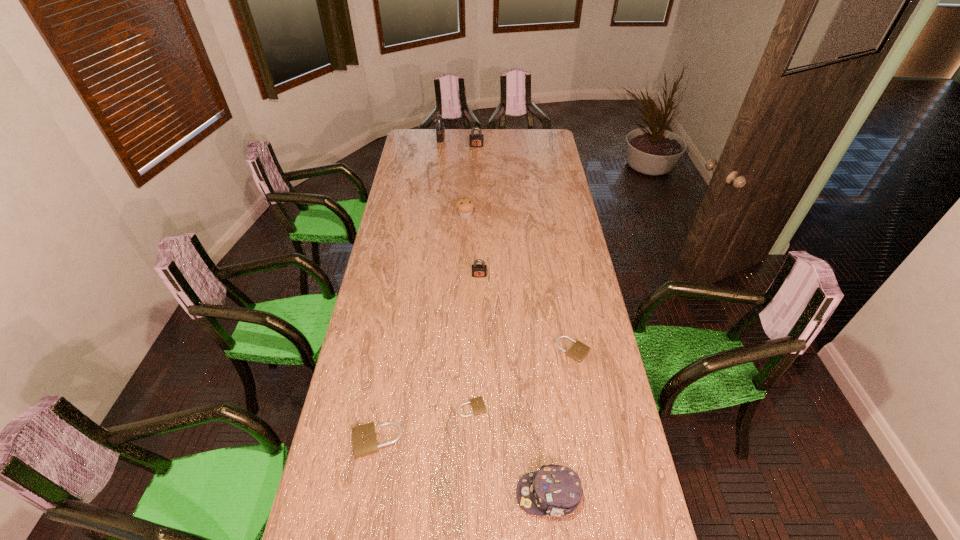
Locate an element on the screen. The height and width of the screenshot is (540, 960). the leftmost gray padlock is located at coordinates (440, 129).

Locate an element on the screen. The height and width of the screenshot is (540, 960). the tallest padlock is located at coordinates (440, 129).

The width and height of the screenshot is (960, 540). What are the coordinates of `the second farthest padlock` in the screenshot? It's located at coord(475,140).

Find the location of `the second tallest object`. the second tallest object is located at coordinates (475, 140).

The height and width of the screenshot is (540, 960). Identify the location of the third tallest padlock. (478, 270).

Find the location of `the nearest gray padlock`. the nearest gray padlock is located at coordinates (478, 270).

Find the location of `muffin`. muffin is located at coordinates (465, 206).

Locate an element on the screen. This screenshot has width=960, height=540. the nearest object is located at coordinates (555, 490).

You are a GUI agent. You are given a task and a screenshot of the screen. Output one action in this format:
    pyautogui.click(x=<x>, y=<y>)
    Task: Click on the leftmost beige padlock
    This screenshot has height=540, width=960.
    Given the screenshot: What is the action you would take?
    pyautogui.click(x=364, y=437)

Image resolution: width=960 pixels, height=540 pixels. In order to click on the biggest beige padlock in this screenshot , I will do `click(364, 437)`.